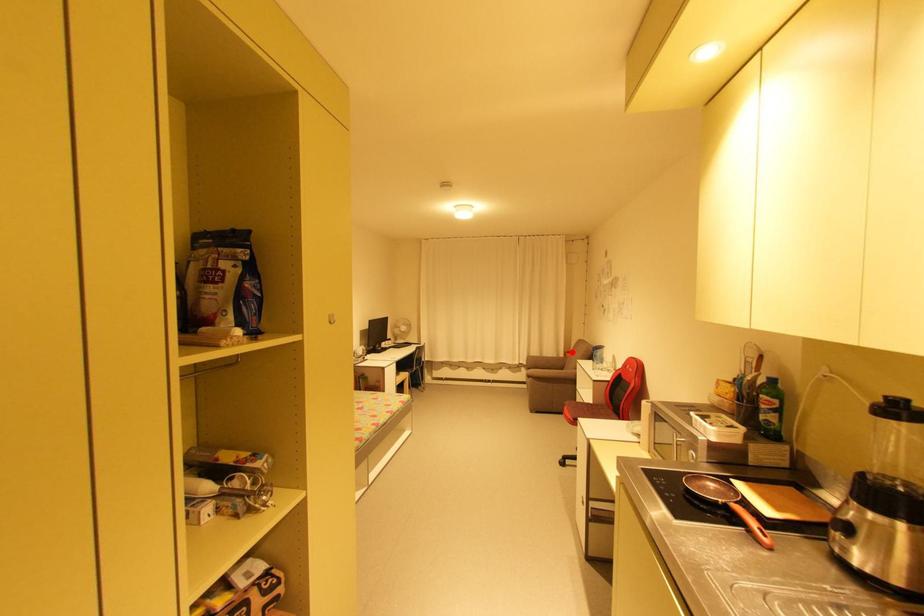
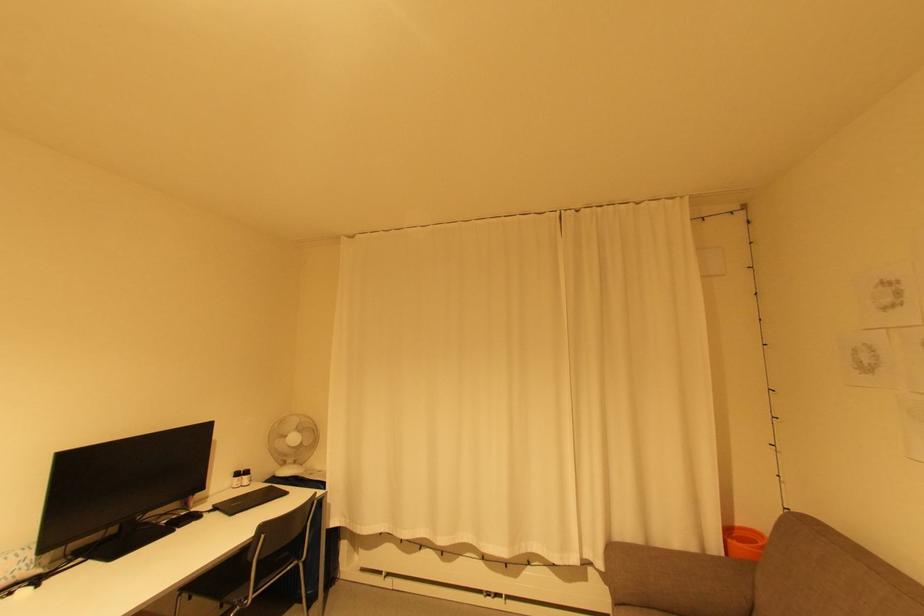
Where in the second image is the point corresponding to the highlighted location from the first image?

(733, 533)